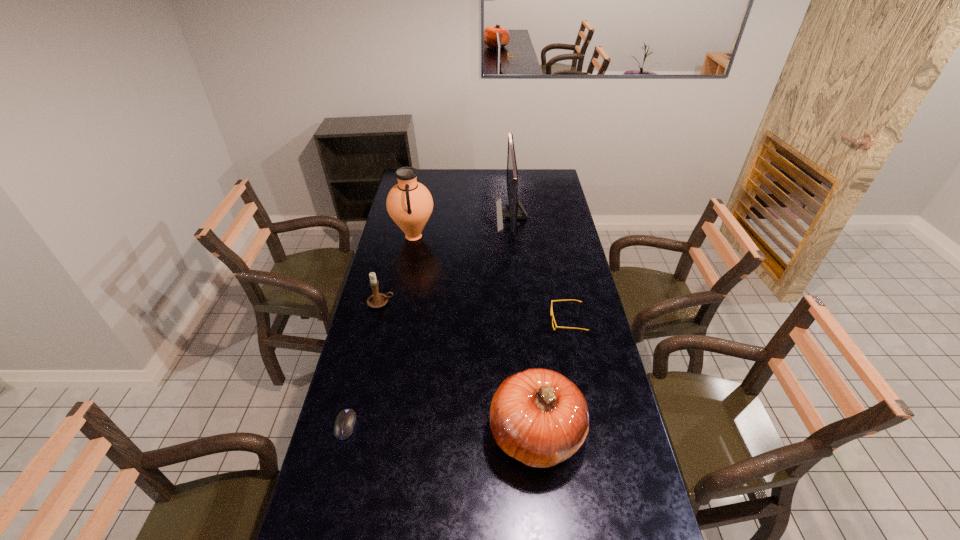
The image size is (960, 540). What are the coordinates of `monitor` in the screenshot? It's located at (513, 214).

What are the coordinates of `pitcher` in the screenshot? It's located at (409, 203).

Locate an element on the screen. This screenshot has width=960, height=540. the third tallest object is located at coordinates (539, 417).

You are a GUI agent. You are given a task and a screenshot of the screen. Output one action in this format:
    pyautogui.click(x=<x>, y=<y>)
    Task: Click on the candle holder
    The height and width of the screenshot is (540, 960).
    Given the screenshot: What is the action you would take?
    pyautogui.click(x=377, y=300)

Where is `spectacles`? spectacles is located at coordinates (552, 316).

Find the location of `computer mouse`. computer mouse is located at coordinates (345, 421).

Find the location of a particular element. The image size is (960, 540). vacant space located on the screen side of the monitor is located at coordinates 441,216.

Where is `vacant point located on the screen side of the monitor`? The height and width of the screenshot is (540, 960). vacant point located on the screen side of the monitor is located at coordinates (452, 216).

This screenshot has height=540, width=960. I want to click on vacant space positioned on the screen side of the monitor, so click(481, 216).

I want to click on free space located on the right of the pitcher, so click(x=509, y=237).